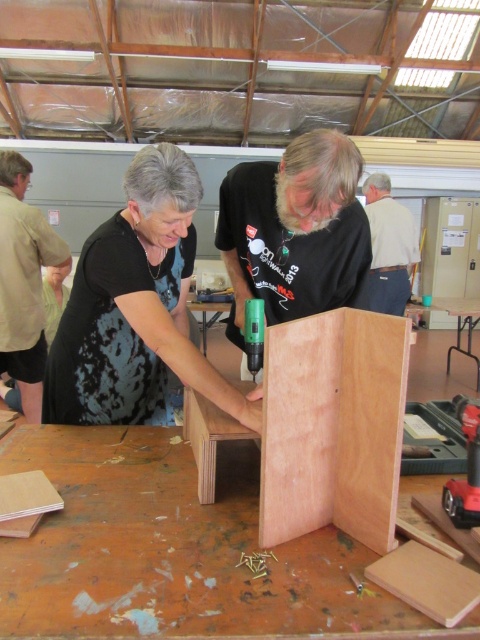
You are standing in the workshop and need to reach both the brown leather shirt at upper center and the green plastic drill at center. Which object is closer to you?

The brown leather shirt at upper center is closer to you because it is further to the viewer than the green plastic drill at center.